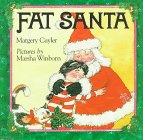
This screenshot has width=143, height=140. Identify the location of book. (114, 105).